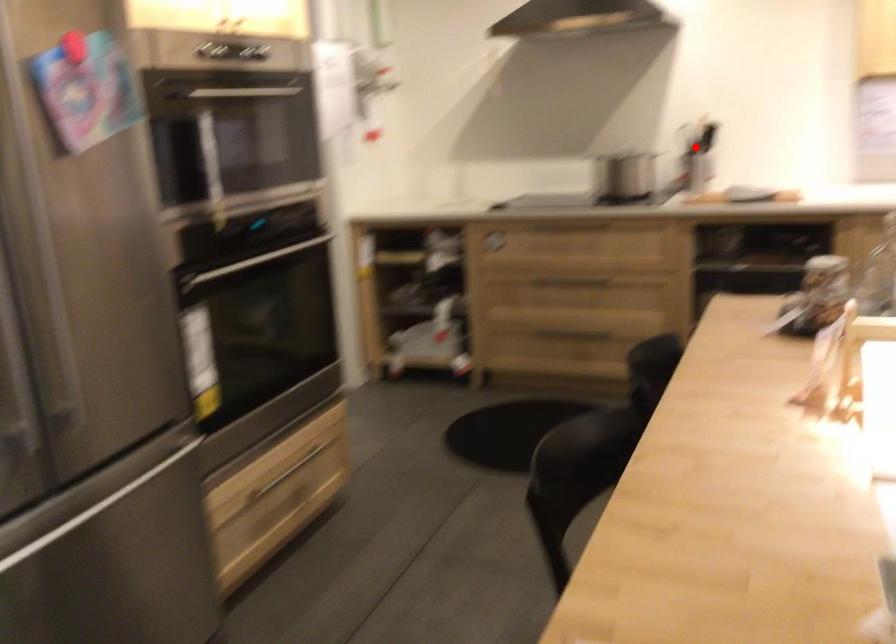
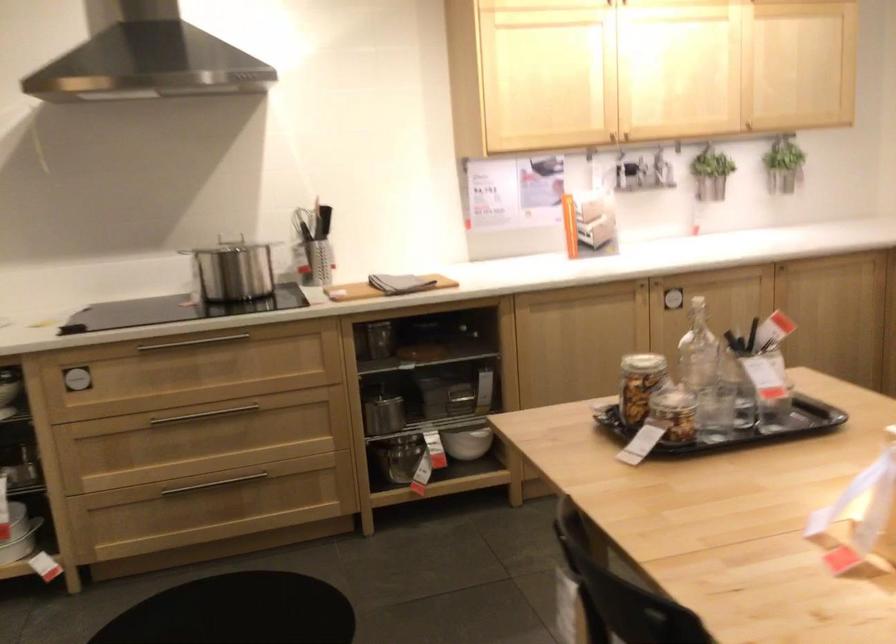
Question: I am providing you with two images of the same scene from different viewpoints. A red point is marked on the first image. At the location where the point appears in image 1, is it still visible in image 2?

Choices:
 (A) Yes
 (B) No

Answer: (A)